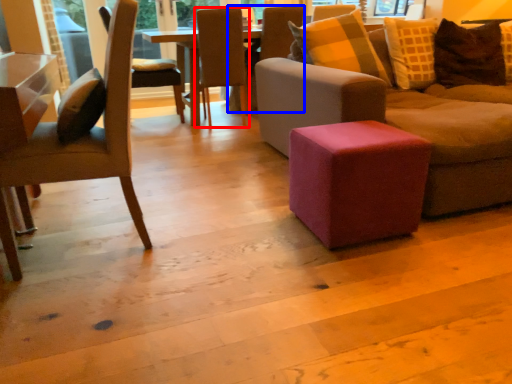
Question: Which of the following is the farthest to the observer, chair (highlighted by a red box) or chair (highlighted by a blue box)?

Choices:
 (A) chair
 (B) chair

Answer: (B)